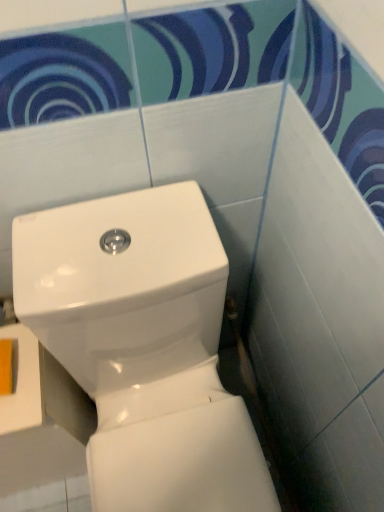
Question: Can you confirm if white glossy toilet at center is shorter than yellow matte toilet paper at lower left?

Choices:
 (A) yes
 (B) no

Answer: (B)

Question: Could you tell me if white glossy toilet at center is turned towards yellow matte toilet paper at lower left?

Choices:
 (A) yes
 (B) no

Answer: (B)

Question: From a real-world perspective, is white glossy toilet at center over yellow matte toilet paper at lower left?

Choices:
 (A) yes
 (B) no

Answer: (B)

Question: Is white glossy toilet at center next to yellow matte toilet paper at lower left and touching it?

Choices:
 (A) no
 (B) yes

Answer: (A)

Question: Is white glossy toilet at center positioned with its back to yellow matte toilet paper at lower left?

Choices:
 (A) no
 (B) yes

Answer: (A)

Question: Would you say yellow matte toilet paper at lower left is part of white glossy toilet at center's contents?

Choices:
 (A) no
 (B) yes

Answer: (A)

Question: Can you confirm if yellow matte toilet paper at lower left is smaller than white glossy toilet at center?

Choices:
 (A) no
 (B) yes

Answer: (B)

Question: From a real-world perspective, is yellow matte toilet paper at lower left on white glossy toilet at center?

Choices:
 (A) yes
 (B) no

Answer: (A)

Question: Is white glossy toilet at center a part of yellow matte toilet paper at lower left?

Choices:
 (A) no
 (B) yes

Answer: (A)

Question: Considering the relative positions of yellow matte toilet paper at lower left and white glossy toilet at center in the image provided, is yellow matte toilet paper at lower left to the right of white glossy toilet at center from the viewer's perspective?

Choices:
 (A) no
 (B) yes

Answer: (A)

Question: Is yellow matte toilet paper at lower left bigger than white glossy toilet at center?

Choices:
 (A) no
 (B) yes

Answer: (A)

Question: Is yellow matte toilet paper at lower left oriented towards white glossy toilet at center?

Choices:
 (A) yes
 (B) no

Answer: (B)

Question: Is white glossy toilet at center in front of or behind yellow matte toilet paper at lower left in the image?

Choices:
 (A) front
 (B) behind

Answer: (A)